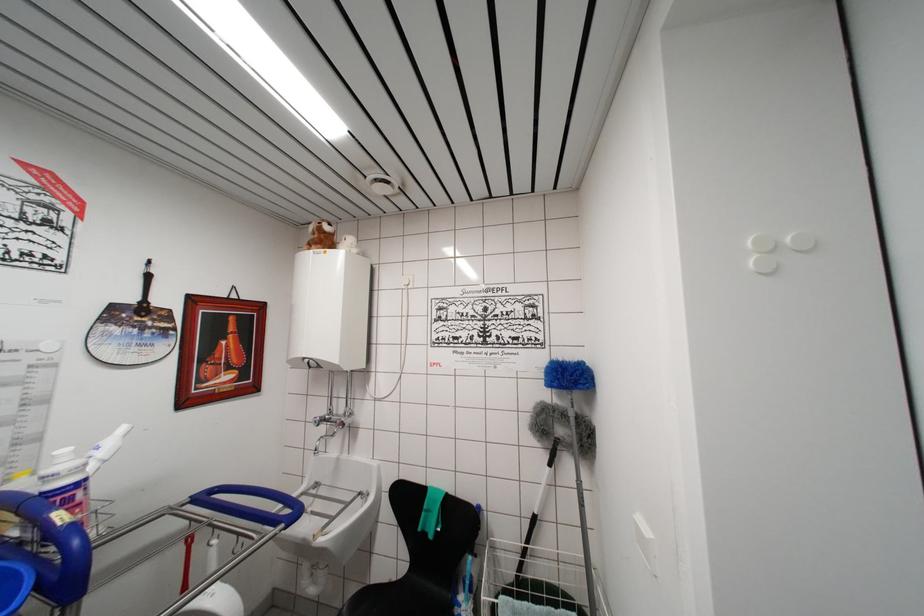
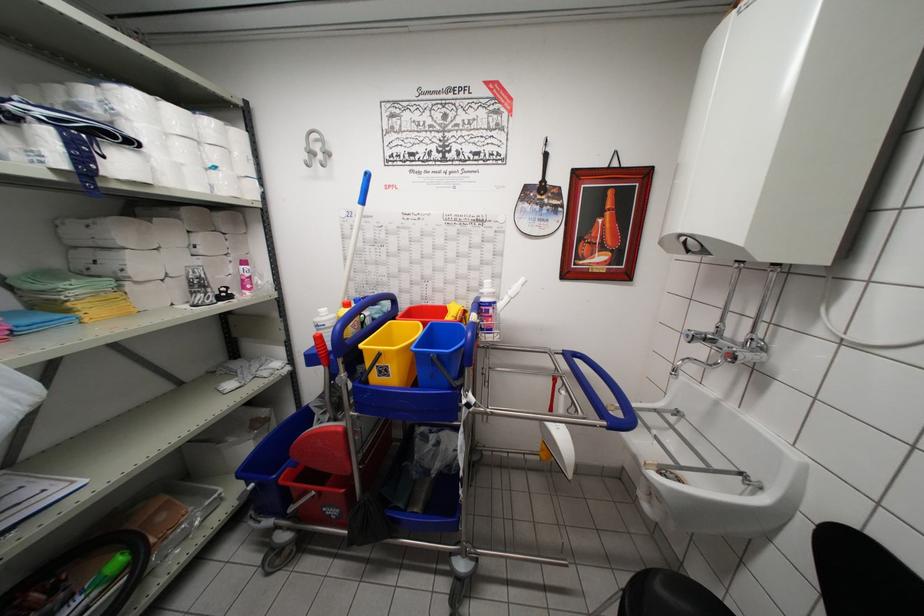
The images are taken continuously from a first-person perspective. In which direction is your viewpoint rotating?

The camera rotated toward left-down.